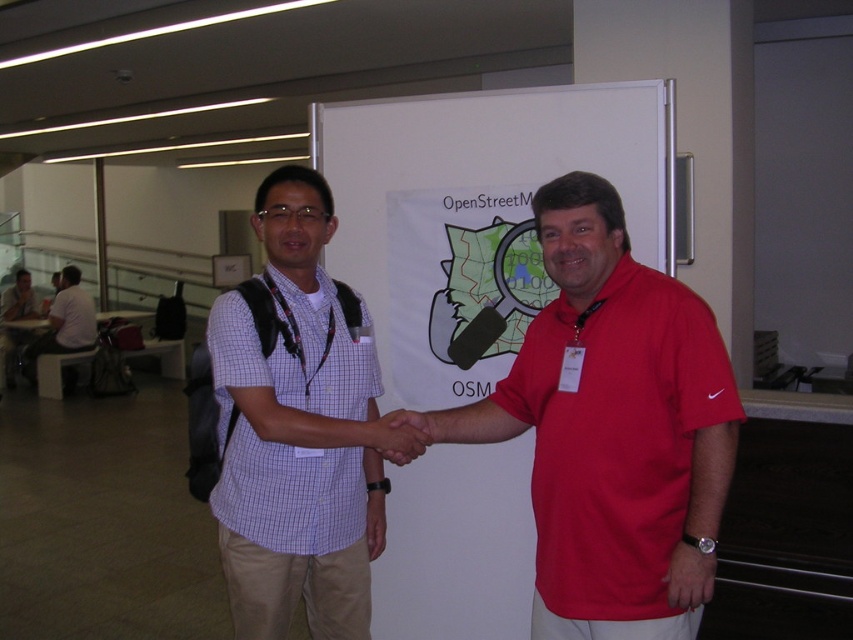
You are attending an event and see two people shaking hands. The red cotton polo shirt at center is shorter than the white shirt at left. Which person is shorter?

The red cotton polo shirt at center is shorter than the white shirt at left, so the person wearing the red cotton polo shirt at center is shorter.

You are standing at the point with coordinates point (71, 336) and want to walk towards the banner. There is an obstacle at point (625, 528). Which direction should you move to avoid it?

Since point (625, 528) is closer to you than point (71, 336), you should move away from the obstacle by heading towards the banner in the opposite direction of the obstacle.